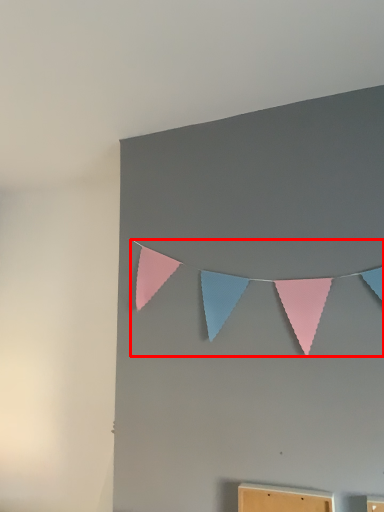
Question: From the image's perspective, what is the correct spatial positioning of clothesline (annotated by the red box) in reference to furniture?

Choices:
 (A) above
 (B) below

Answer: (A)